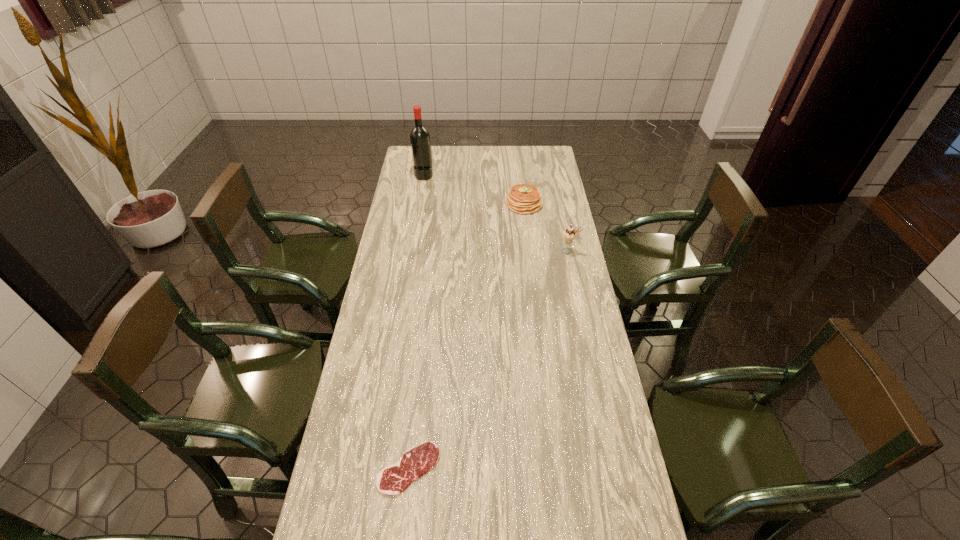
In order to click on the farthest object in this screenshot , I will do `click(420, 140)`.

Identify the location of the tallest object. (x=420, y=140).

The height and width of the screenshot is (540, 960). In order to click on icecream in this screenshot , I will do `click(569, 234)`.

This screenshot has width=960, height=540. Find the location of `the third farthest object`. the third farthest object is located at coordinates (569, 234).

You are a GUI agent. You are given a task and a screenshot of the screen. Output one action in this format:
    pyautogui.click(x=<x>, y=<y>)
    Task: Click on the second shortest object
    The image size is (960, 540).
    Given the screenshot: What is the action you would take?
    pyautogui.click(x=522, y=198)

You are a GUI agent. You are given a task and a screenshot of the screen. Output one action in this format:
    pyautogui.click(x=<x>, y=<y>)
    Task: Click on the third nearest object
    Image resolution: width=960 pixels, height=540 pixels.
    Given the screenshot: What is the action you would take?
    pyautogui.click(x=522, y=198)

The height and width of the screenshot is (540, 960). I want to click on the shortest object, so click(x=392, y=480).

You are a GUI agent. You are given a task and a screenshot of the screen. Output one action in this format:
    pyautogui.click(x=<x>, y=<y>)
    Task: Click on the steak
    The height and width of the screenshot is (540, 960).
    Given the screenshot: What is the action you would take?
    pyautogui.click(x=392, y=480)

Identify the location of free space located 0.110m on the back of the tallest object. Image resolution: width=960 pixels, height=540 pixels. (427, 158).

Where is `vacant region located on the back of the third farthest object`? vacant region located on the back of the third farthest object is located at coordinates (561, 212).